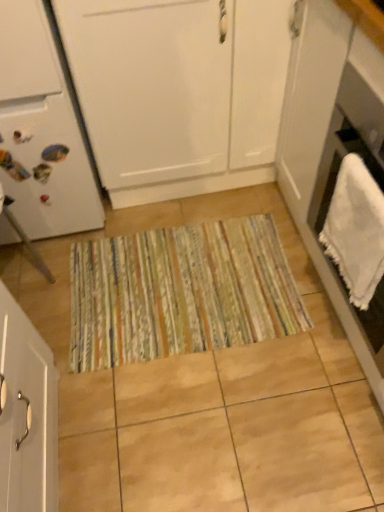
Question: Which is correct: white matte cabinet at lower left, the second cabinetry when ordered from top to bottom, is inside striped fabric doormat at center, or outside of it?

Choices:
 (A) inside
 (B) outside

Answer: (B)

Question: Considering the positions of white matte cabinet at lower left, the second cabinetry when ordered from top to bottom, and striped fabric doormat at center in the image, is white matte cabinet at lower left, the second cabinetry when ordered from top to bottom, bigger or smaller than striped fabric doormat at center?

Choices:
 (A) big
 (B) small

Answer: (A)

Question: Which is nearer to the white towel at right?

Choices:
 (A) white fluffy towel at right
 (B) white matte refrigerator at left
 (C) white matte cabinet at lower left, the second cabinetry when ordered from top to bottom
 (D) striped fabric doormat at center
 (E) white matte cabinet at center, the second cabinetry positioned from the bottom

Answer: (A)

Question: Which is farther from the white matte refrigerator at left?

Choices:
 (A) white matte cabinet at center, the first cabinetry from the top
 (B) white fluffy towel at right
 (C) white matte cabinet at lower left, the second cabinetry when ordered from top to bottom
 (D) white towel at right
 (E) striped fabric doormat at center

Answer: (B)